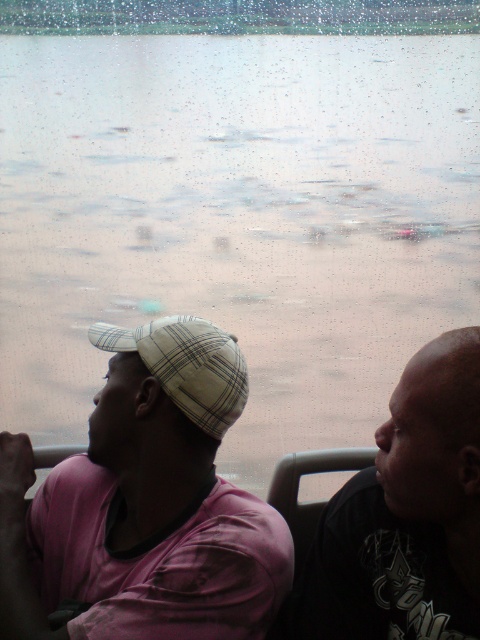
You are a passenger on a bus or boat and see two people seated in front of you. The person on the right is wearing a dark gray matte shirt, and the person on the left has a plaid fabric baseball cap. If you want to hand a note to the person with the plaid fabric baseball cap at left without disturbing the person in the dark gray matte shirt at right, which direction should you lean?

You should lean to the left side because the plaid fabric baseball cap at left is positioned to the left of the dark gray matte shirt at right, so leaning left allows you to reach them without disturbing the person on the right.